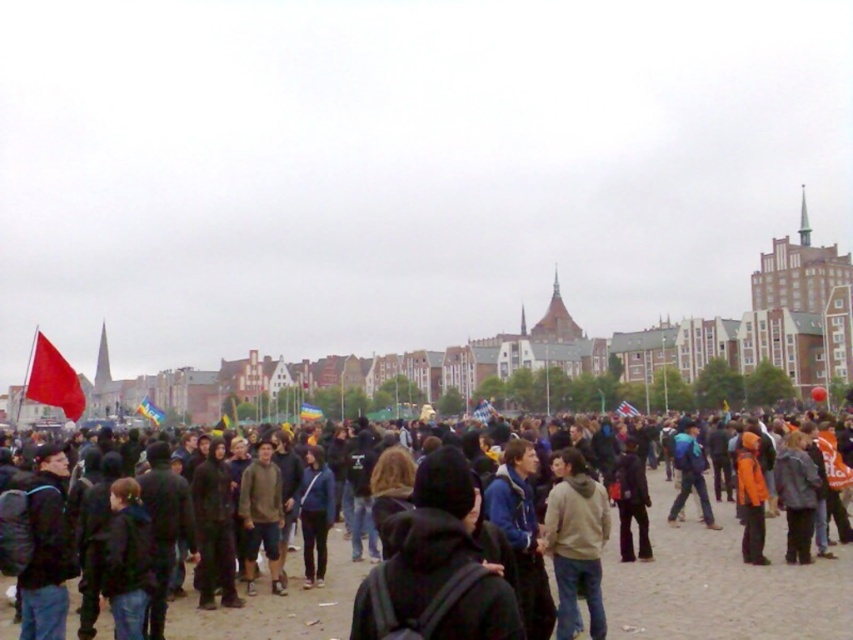
Question: Based on their relative distances, which object is nearer to the dark clothing crowd at center?

Choices:
 (A) white fabric flag at center
 (B) matte red flag at left

Answer: (A)

Question: Does dark clothing crowd at center appear under rainbow fabric flag at center?

Choices:
 (A) yes
 (B) no

Answer: (A)

Question: Which point appears farthest from the camera in this image?

Choices:
 (A) (25, 390)
 (B) (724, 611)
 (C) (148, 413)

Answer: (A)

Question: Which object is positioned closest to the orange fabric jacket at center?

Choices:
 (A) dark clothing crowd at center
 (B) white fabric flag at center

Answer: (A)

Question: Does dark clothing crowd at center appear on the left side of light brown hoodie at center?

Choices:
 (A) yes
 (B) no

Answer: (A)

Question: Is light brown hoodie at center below white fabric flag at center?

Choices:
 (A) no
 (B) yes

Answer: (B)